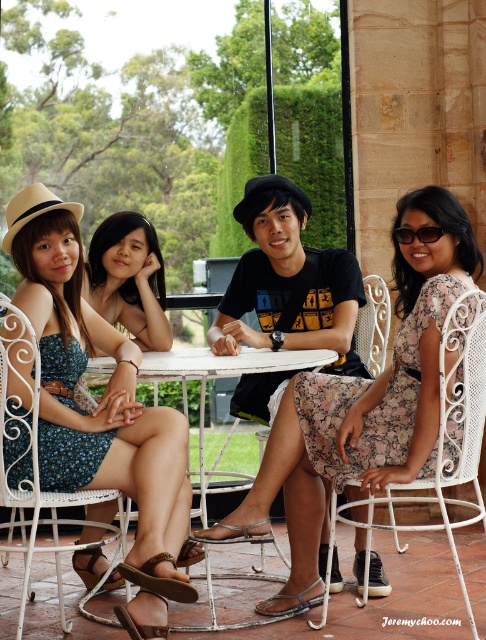
Does black cotton t-shirt at center have a lesser width compared to black plastic sunglasses at upper right?

No, black cotton t-shirt at center is not thinner than black plastic sunglasses at upper right.

Identify the location of black cotton t-shirt at center. (289, 282).

Locate an element on the screen. Image resolution: width=486 pixels, height=640 pixels. black cotton t-shirt at center is located at coordinates (289, 282).

Is point (258, 285) more distant than point (335, 518)?

That is True.

Who is shorter, black cotton t-shirt at center or white wrought iron chair at lower right?

black cotton t-shirt at center

Image resolution: width=486 pixels, height=640 pixels. Find the location of `black cotton t-shirt at center`. black cotton t-shirt at center is located at coordinates (289, 282).

Is black cotton t-shirt at center thinner than white metal table at center?

Indeed, black cotton t-shirt at center has a lesser width compared to white metal table at center.

Does point (326, 272) come in front of point (323, 356)?

No.

Image resolution: width=486 pixels, height=640 pixels. Identify the location of black cotton t-shirt at center. (289, 282).

Locate an element on the screen. This screenshot has width=486, height=640. black cotton t-shirt at center is located at coordinates (289, 282).